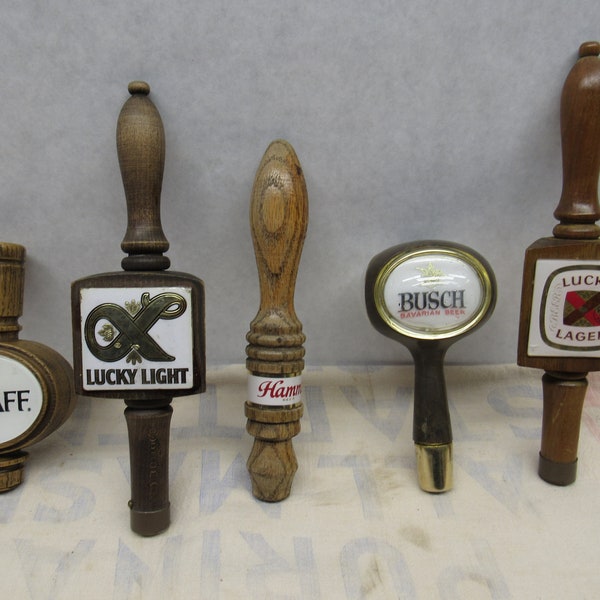
Locate an element on the screen. taps is located at coordinates (28, 417), (122, 357), (277, 315), (435, 315), (571, 310).